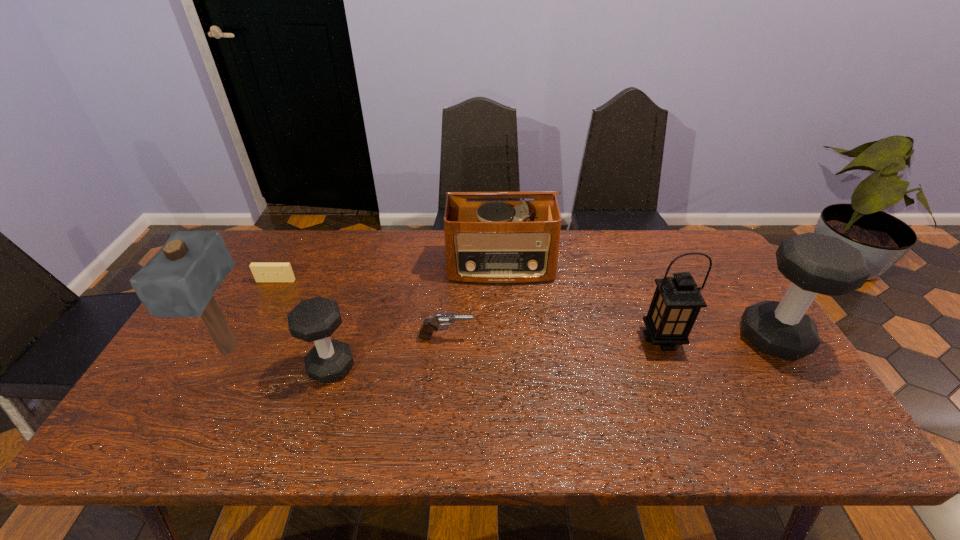
Find the location of a particular element. vacant region between the shortest object and the mallet is located at coordinates (252, 315).

Identify the location of vacant space that is in between the shortest object and the lantern. (468, 310).

Locate an element on the screen. This screenshot has width=960, height=540. vacant area that lies between the radio receiver and the pistol is located at coordinates (473, 302).

Where is `vacant area that lies between the radio receiver and the second shortest object`? vacant area that lies between the radio receiver and the second shortest object is located at coordinates (473, 302).

The width and height of the screenshot is (960, 540). Find the location of `object that stands as the third closest to the shorter dumbbell`. object that stands as the third closest to the shorter dumbbell is located at coordinates (263, 272).

At what (x,y) coordinates should I click in order to perform the action: click on object that stands as the sixth closest to the pistol. Please return your answer as a coordinate pair (x, y). Looking at the image, I should click on (814, 263).

You are a GUI agent. You are given a task and a screenshot of the screen. Output one action in this format:
    pyautogui.click(x=<x>, y=<y>)
    Task: Click on the vacant area that satisfies the following two spatial constraints: 1. at the front of the shortest object with spools; 2. on the left side of the shorter dumbbell
    This screenshot has height=540, width=960.
    Given the screenshot: What is the action you would take?
    pyautogui.click(x=230, y=367)

You are a GUI agent. You are given a task and a screenshot of the screen. Output one action in this format:
    pyautogui.click(x=<x>, y=<y>)
    Task: Click on the free spot that satisfies the following two spatial constraints: 1. at the front of the second object from right to left with spools; 2. on the right side of the videotape
    Image resolution: width=960 pixels, height=540 pixels.
    Given the screenshot: What is the action you would take?
    pyautogui.click(x=246, y=339)

Where is `free space that satisfies the following two spatial constraints: 1. at the barrel of the sixth tallest object; 2. on the back side of the lantern`? This screenshot has width=960, height=540. free space that satisfies the following two spatial constraints: 1. at the barrel of the sixth tallest object; 2. on the back side of the lantern is located at coordinates (445, 339).

At what (x,y) coordinates should I click in order to perform the action: click on vacant region that satisfies the following two spatial constraints: 1. at the barrel of the second shortest object; 2. on the front side of the third shortest object. Please return your answer as a coordinate pair (x, y). Image resolution: width=960 pixels, height=540 pixels. Looking at the image, I should click on (444, 367).